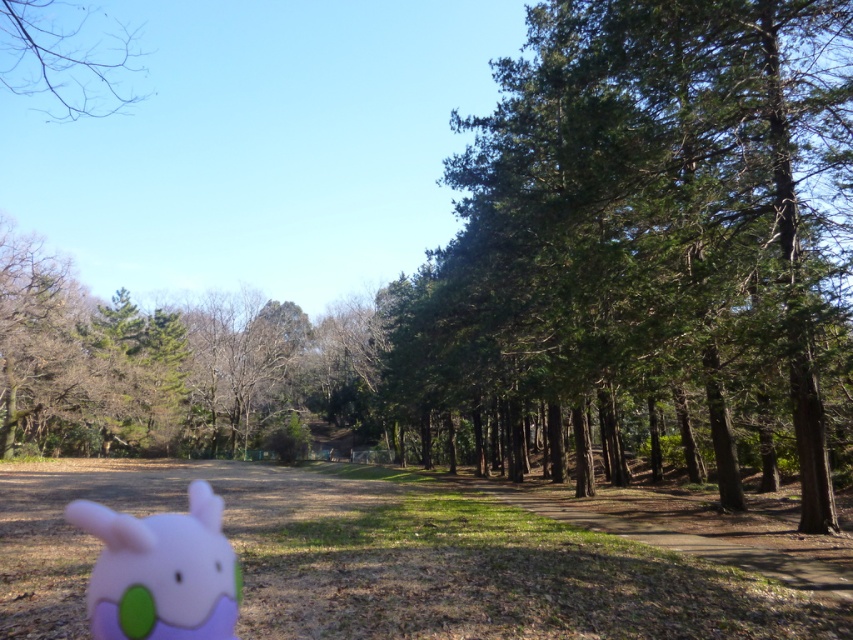
You are standing at the center of the scene looking towards the middle ground. Can you see the plush pink toy at lower left from this position?

The plush pink toy at lower left is located at point (x=161, y=572), which is in the lower left area of the scene. Since you are standing at the center looking towards the middle ground, your line of sight would be directed towards the central area, making it unlikely that you can see the plush pink toy at lower left from this position without turning your head or moving.

You are a photographer trying to capture a photo of the green textured tree at center and the plush pink toy at lower left. If you want to ensure both are in focus, which object should you position closer to the camera to maintain clarity?

The green textured tree at center is taller than the plush pink toy at lower left, so positioning the plush pink toy at lower left closer to the camera would help keep both in focus by reducing the depth of field difference between them.

You are standing at the point marked as point (653,236) in the image. What object is directly in front of you?

The green textured tree at center is located at point (653,236), so the object directly in front of you is the green textured tree at center.